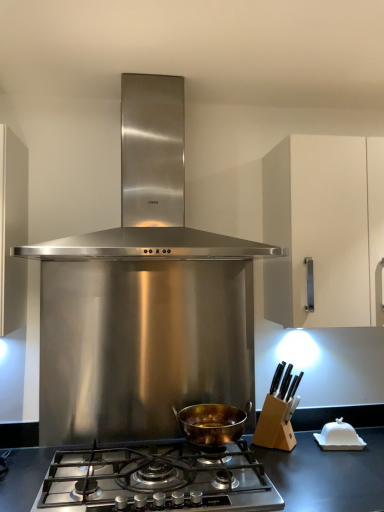
The height and width of the screenshot is (512, 384). I want to click on free region under gold-bronze pot at center, which ranks as the 1th kitchen appliance in bottom-to-top order (from a real-world perspective), so click(x=210, y=441).